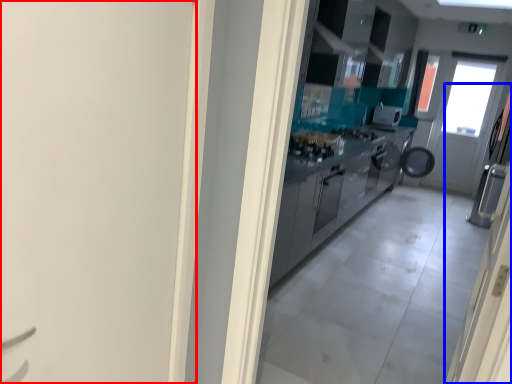
Question: Which object is further to the camera taking this photo, door (highlighted by a red box) or door (highlighted by a blue box)?

Choices:
 (A) door
 (B) door

Answer: (B)